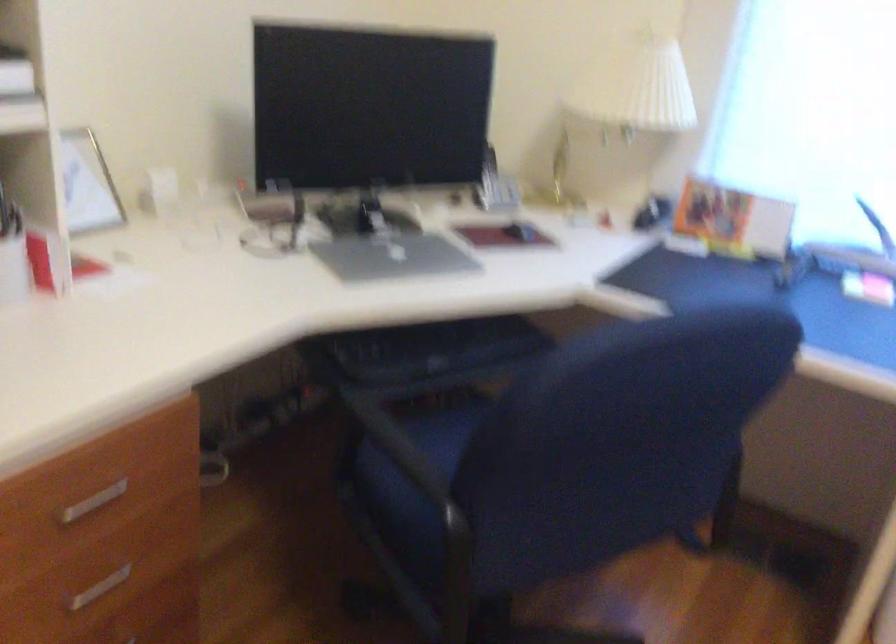
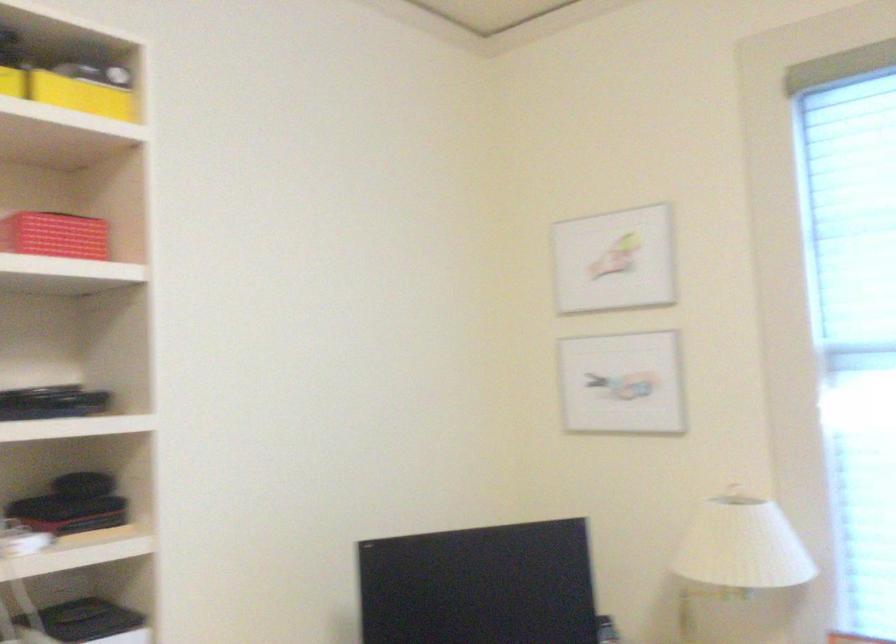
Question: The first image is from the beginning of the video and the second image is from the end. How did the camera likely rotate when shooting the video?

Choices:
 (A) Left
 (B) Right
 (C) Up
 (D) Down

Answer: (C)